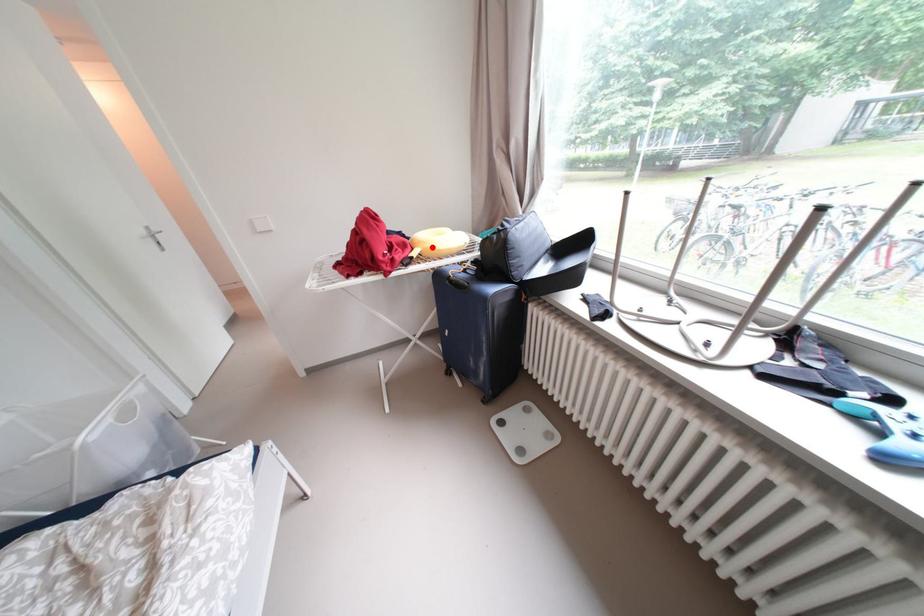
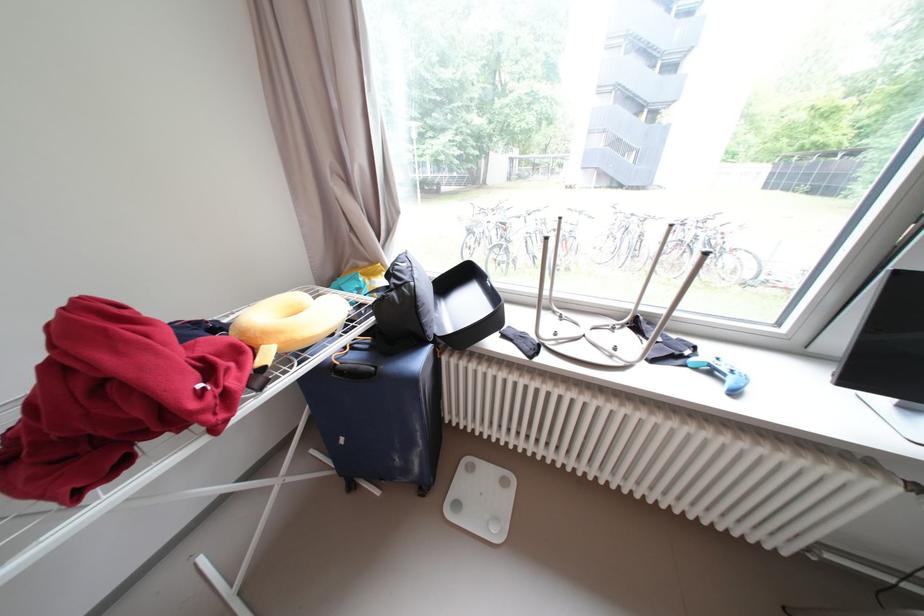
The point at the highlighted location is marked in the first image. Where is the corresponding point in the second image?

(290, 339)